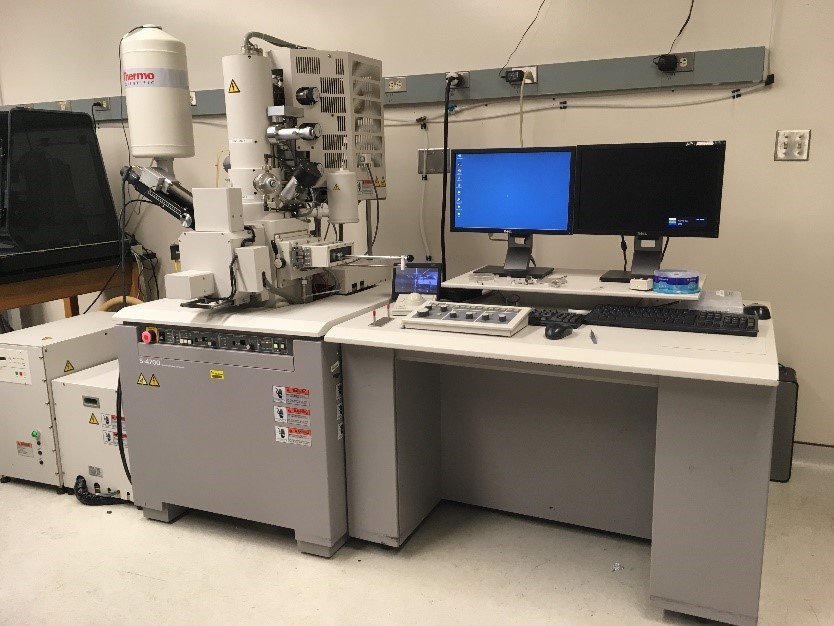
The width and height of the screenshot is (834, 626). In order to click on white desk top' in this screenshot , I will do `click(625, 350)`.